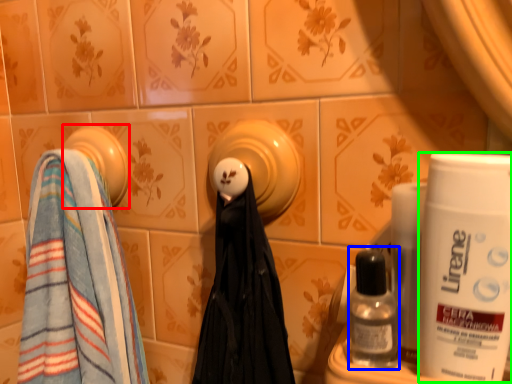
Question: Considering the real-world distances, which object is closest to towel (highlighted by a red box)? mouthwash (highlighted by a blue box) or shaving cream (highlighted by a green box).

Choices:
 (A) mouthwash
 (B) shaving cream

Answer: (A)